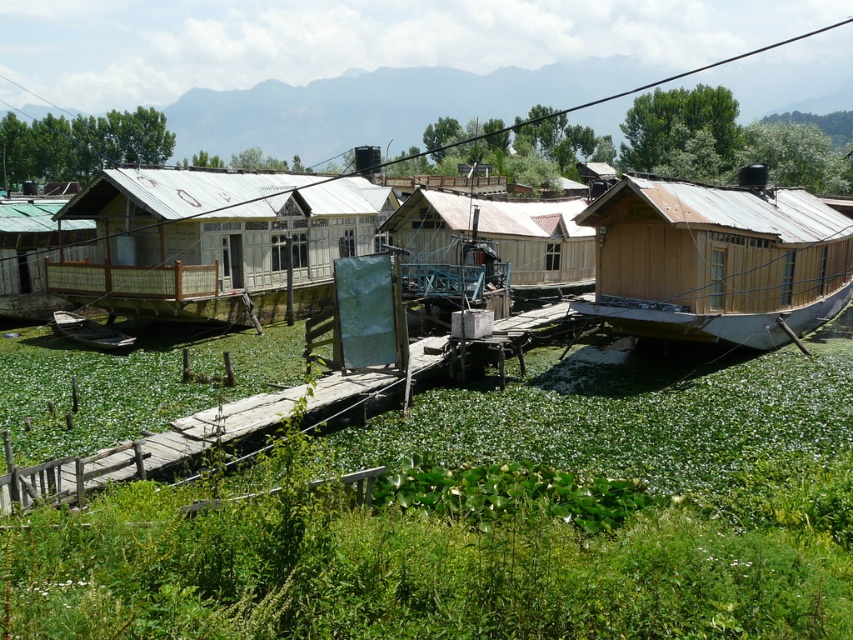
Question: Does brown wooden houseboat at center have a smaller size compared to green bamboo hut at left?

Choices:
 (A) yes
 (B) no

Answer: (B)

Question: Which point is farther to the camera?

Choices:
 (A) tap(526, 248)
 (B) tap(99, 337)

Answer: (A)

Question: Does brown wooden houseboat at center have a larger size compared to wooden hut at center?

Choices:
 (A) no
 (B) yes

Answer: (B)

Question: Which point appears closest to the camera in this image?

Choices:
 (A) (78, 330)
 (B) (579, 257)
 (C) (695, 307)
 (D) (26, 257)

Answer: (C)

Question: From the image, what is the correct spatial relationship of brown wooden houseboat at center in relation to wooden hut at center?

Choices:
 (A) below
 (B) above

Answer: (A)

Question: Which of the following is the farthest from the observer?

Choices:
 (A) wooden hut at center
 (B) brown wooden houseboat at center
 (C) wooden boat at lower left

Answer: (A)